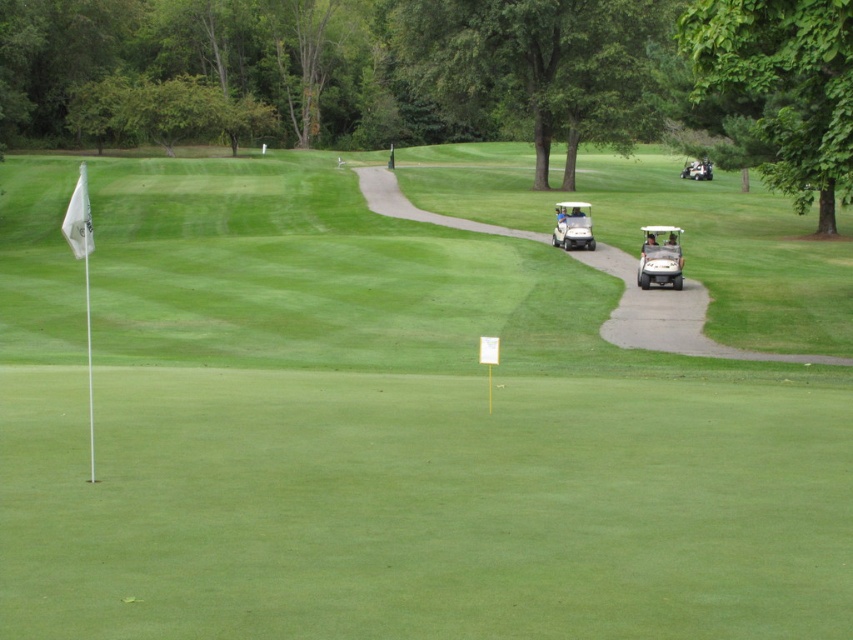
You are a golf cart driver who needs to park your matte white golf cart at right in a space designed for the white plastic golf cart at center. Will your cart fit in the space?

The matte white golf cart at right is wider than the white plastic golf cart at center, so it will not fit in the space designed for the latter.